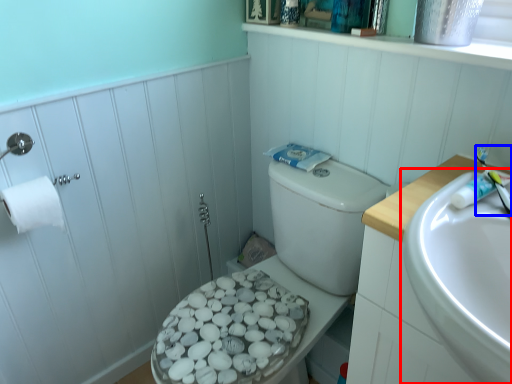
Question: Which of the following is the farthest to the observer, sink (highlighted by a red box) or toothbrush (highlighted by a blue box)?

Choices:
 (A) sink
 (B) toothbrush

Answer: (B)